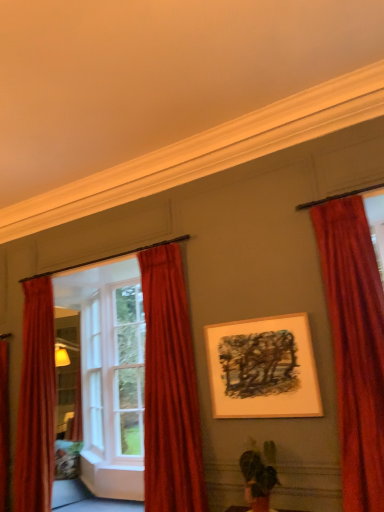
Question: From the image's perspective, is wooden framed artwork at center positioned above or below green matte plant at lower center?

Choices:
 (A) above
 (B) below

Answer: (A)

Question: From a real-world perspective, relative to green matte plant at lower center, is wooden framed artwork at center vertically above or below?

Choices:
 (A) above
 (B) below

Answer: (A)

Question: Which is farther from the white wood window frame at left?

Choices:
 (A) velvet red curtain at center, which is the 2th curtain in left-to-right order
 (B) wooden framed artwork at center
 (C) velvet red curtain at left, the 3th curtain in the right-to-left sequence
 (D) green matte plant at lower center
 (E) velvet red curtain at right, which is the 3th curtain in left-to-right order

Answer: (C)

Question: Considering the real-world distances, which object is closest to the green matte plant at lower center?

Choices:
 (A) velvet red curtain at left, the first curtain from the left
 (B) velvet red curtain at right, which is counted as the 1th curtain, starting from the right
 (C) velvet red curtain at center, which is the 2th curtain in left-to-right order
 (D) white wood window frame at left
 (E) wooden framed artwork at center

Answer: (E)